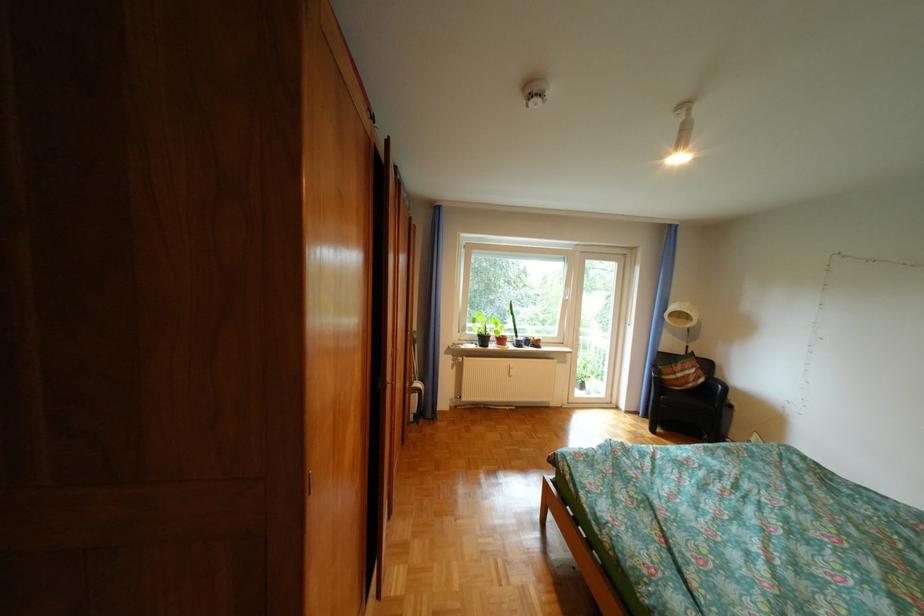
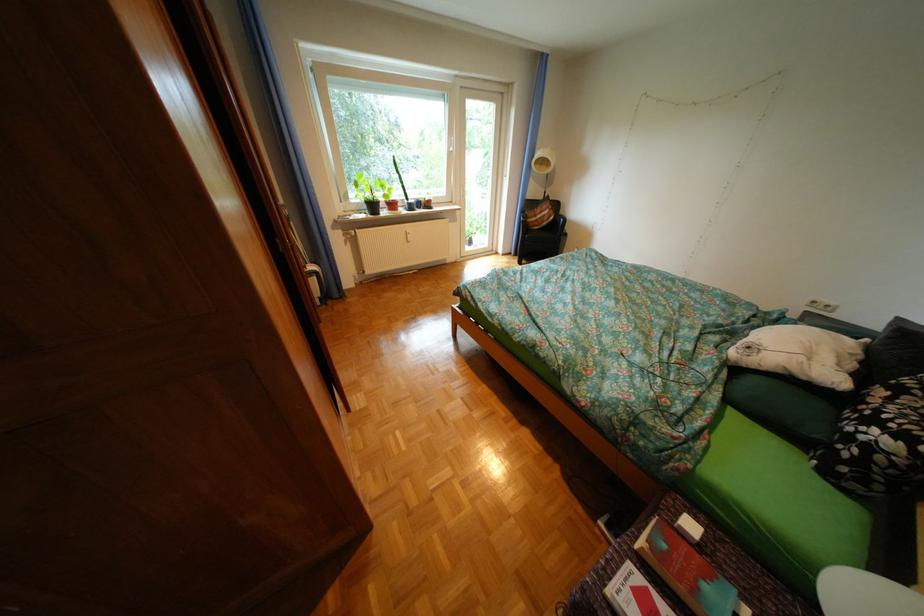
In the second image, find the point that corresponds to the point at 497,339 in the first image.

(387, 207)